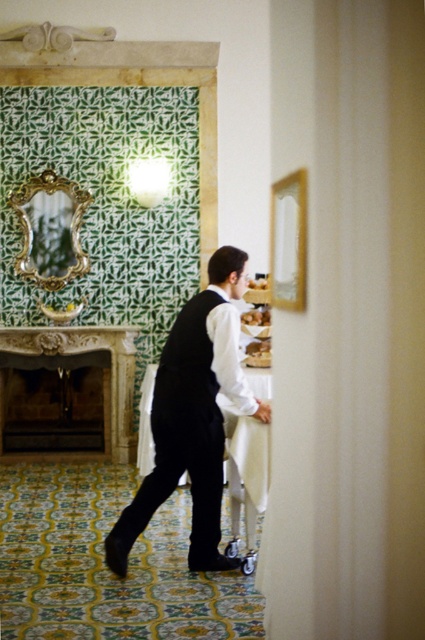
Question: Estimate the real-world distances between objects in this image. Which object is farther from the black satin vest at center?

Choices:
 (A) white glossy picture frame at upper right
 (B) golden textured bread at right
 (C) gold ornate mirror at upper left
 (D) smooth cream cheese at upper center

Answer: (C)

Question: Observing the image, what is the correct spatial positioning of gold ornate mirror at upper left in reference to white glossy picture frame at upper right?

Choices:
 (A) right
 (B) left

Answer: (B)

Question: Which of these objects is positioned closest to the golden textured bread at right?

Choices:
 (A) white glossy picture frame at upper right
 (B) smooth cream cheese at upper center

Answer: (B)

Question: Does gold ornate mirror at upper left appear over smooth cream cheese at upper center?

Choices:
 (A) no
 (B) yes

Answer: (B)

Question: Is gold ornate mirror at upper left wider than smooth cream cheese at upper center?

Choices:
 (A) no
 (B) yes

Answer: (B)

Question: Among these points, which one is farthest from the camera?

Choices:
 (A) (292, 208)
 (B) (252, 323)
 (C) (249, 284)
 (D) (226, 339)

Answer: (B)